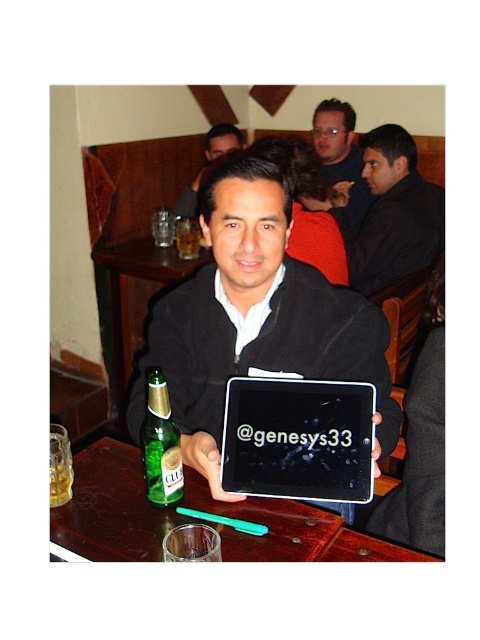
Does matte black tablet at center appear on the right side of translucent glass at table center?

Indeed, matte black tablet at center is positioned on the right side of translucent glass at table center.

Does matte black tablet at center have a greater width compared to translucent glass at table center?

Yes, matte black tablet at center is wider than translucent glass at table center.

Find the location of a particular element. The width and height of the screenshot is (480, 640). matte black tablet at center is located at coordinates (255, 320).

Is green glass bottle at left taller than translucent glass at table left?

Yes.

Is point (169, 406) positioned after point (61, 483)?

No.

Describe the element at coordinates (160, 445) in the screenshot. I see `green glass bottle at left` at that location.

Where is `green glass bottle at left`? The height and width of the screenshot is (640, 480). green glass bottle at left is located at coordinates (160, 445).

Can you confirm if matte black jacket at center is thinner than translucent glass at table center?

Incorrect, matte black jacket at center's width is not less than translucent glass at table center's.

Between matte black jacket at center and translucent glass at table center, which one has more height?

translucent glass at table center

Is point (192, 204) less distant than point (194, 232)?

No, (192, 204) is further to viewer.

Where is `matte black jacket at center`? Image resolution: width=480 pixels, height=640 pixels. matte black jacket at center is located at coordinates [x=208, y=163].